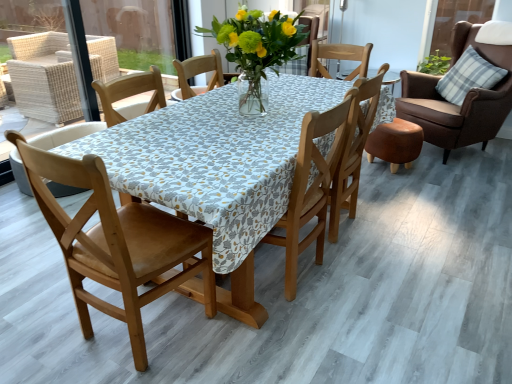
Find the location of a particular element. wooden chair at center, the 1th chair when ordered from left to right is located at coordinates (116, 242).

Describe the element at coordinates (353, 148) in the screenshot. The image size is (512, 384). I see `wooden chair at center, marked as the fourth chair in a left-to-right arrangement` at that location.

What do you see at coordinates (463, 102) in the screenshot? The width and height of the screenshot is (512, 384). I see `brown leather chair at upper right, positioned as the 5th chair in left-to-right order` at bounding box center [463, 102].

Where is `wooden chair at center, acting as the 2th chair starting from the left`? This screenshot has width=512, height=384. wooden chair at center, acting as the 2th chair starting from the left is located at coordinates (130, 94).

The height and width of the screenshot is (384, 512). I want to click on wooden chair at center, the fifth chair from the right, so 116,242.

Does plaid fabric pillow at upper right turn towards wooden chair at center, arranged as the 2th chair when viewed from the right?

Yes, plaid fabric pillow at upper right is oriented towards wooden chair at center, arranged as the 2th chair when viewed from the right.

Does point (449, 95) come behind point (330, 233)?

Yes, point (449, 95) is farther from viewer.

Are plaid fabric pillow at upper right and wooden chair at center, arranged as the 2th chair when viewed from the right, far apart?

Yes, plaid fabric pillow at upper right is far from wooden chair at center, arranged as the 2th chair when viewed from the right.

Can you tell me how much plaid fabric pillow at upper right and wooden chair at center, marked as the fourth chair in a left-to-right arrangement, differ in facing direction?

There is a 63.2-degree angle between the facing directions of plaid fabric pillow at upper right and wooden chair at center, marked as the fourth chair in a left-to-right arrangement.

Which of these two, brown leather chair at upper right, marked as the 1th chair in a right-to-left arrangement, or wooden chair at center, placed as the third chair when sorted from right to left, is bigger?

brown leather chair at upper right, marked as the 1th chair in a right-to-left arrangement.

Are brown leather chair at upper right, positioned as the 5th chair in left-to-right order, and wooden chair at center, which appears as the third chair when viewed from the left, far apart?

Absolutely, brown leather chair at upper right, positioned as the 5th chair in left-to-right order, is distant from wooden chair at center, which appears as the third chair when viewed from the left.

Considering the relative positions of brown leather chair at upper right, marked as the 1th chair in a right-to-left arrangement, and wooden chair at center, placed as the third chair when sorted from right to left, in the image provided, is brown leather chair at upper right, marked as the 1th chair in a right-to-left arrangement, behind wooden chair at center, placed as the third chair when sorted from right to left,?

Yes, brown leather chair at upper right, marked as the 1th chair in a right-to-left arrangement, is behind wooden chair at center, placed as the third chair when sorted from right to left.

Is brown leather chair at upper right, marked as the 1th chair in a right-to-left arrangement, aimed at wooden chair at center, which appears as the third chair when viewed from the left?

Yes, brown leather chair at upper right, marked as the 1th chair in a right-to-left arrangement, is facing wooden chair at center, which appears as the third chair when viewed from the left.

Could you tell me if wooden chair at center, which appears as the third chair when viewed from the left, is turned towards wooden chair at center, acting as the 2th chair starting from the left?

Yes, wooden chair at center, which appears as the third chair when viewed from the left, is aimed at wooden chair at center, acting as the 2th chair starting from the left.

From a real-world perspective, is wooden chair at center, placed as the third chair when sorted from right to left, physically above wooden chair at center, acting as the 2th chair starting from the left?

No, from a real-world perspective, wooden chair at center, placed as the third chair when sorted from right to left, is not above wooden chair at center, acting as the 2th chair starting from the left.

Which of these two, wooden chair at center, which appears as the third chair when viewed from the left, or wooden chair at center, which appears as the fourth chair when viewed from the right, is bigger?

wooden chair at center, which appears as the third chair when viewed from the left.

From the image's perspective, which one is positioned higher, wooden chair at center, which appears as the fourth chair when viewed from the right, or wooden chair at center, which appears as the third chair when viewed from the left?

From the image's view, wooden chair at center, which appears as the fourth chair when viewed from the right, is above.

How distant is wooden chair at center, acting as the 2th chair starting from the left, from wooden chair at center, placed as the third chair when sorted from right to left?

The distance of wooden chair at center, acting as the 2th chair starting from the left, from wooden chair at center, placed as the third chair when sorted from right to left, is 3.45 feet.

Can you confirm if wooden chair at center, which appears as the fourth chair when viewed from the right, is smaller than wooden chair at center, placed as the third chair when sorted from right to left?

Correct, wooden chair at center, which appears as the fourth chair when viewed from the right, occupies less space than wooden chair at center, placed as the third chair when sorted from right to left.

Considering the relative positions of wooden chair at center, acting as the 2th chair starting from the left, and wooden chair at center, placed as the third chair when sorted from right to left, in the image provided, is wooden chair at center, acting as the 2th chair starting from the left, behind wooden chair at center, placed as the third chair when sorted from right to left,?

Yes, the depth of wooden chair at center, acting as the 2th chair starting from the left, is greater than that of wooden chair at center, placed as the third chair when sorted from right to left.

Is point (475, 124) closer to viewer compared to point (101, 247)?

No.

Is brown leather chair at upper right, marked as the 1th chair in a right-to-left arrangement, not close to wooden chair at center, the fifth chair from the right?

Yes, brown leather chair at upper right, marked as the 1th chair in a right-to-left arrangement, is far from wooden chair at center, the fifth chair from the right.

What's the angular difference between brown leather chair at upper right, positioned as the 5th chair in left-to-right order, and wooden chair at center, the fifth chair from the right,'s facing directions?

There is a 148-degree angle between the facing directions of brown leather chair at upper right, positioned as the 5th chair in left-to-right order, and wooden chair at center, the fifth chair from the right.

Is brown leather chair at upper right, marked as the 1th chair in a right-to-left arrangement, taller than wooden chair at center, the fifth chair from the right?

Indeed, brown leather chair at upper right, marked as the 1th chair in a right-to-left arrangement, has a greater height compared to wooden chair at center, the fifth chair from the right.

Considering the sizes of brown leather chair at upper right, marked as the 1th chair in a right-to-left arrangement, and wooden chair at center, marked as the fourth chair in a left-to-right arrangement, in the image, is brown leather chair at upper right, marked as the 1th chair in a right-to-left arrangement, wider or thinner than wooden chair at center, marked as the fourth chair in a left-to-right arrangement,?

Clearly, brown leather chair at upper right, marked as the 1th chair in a right-to-left arrangement, has more width compared to wooden chair at center, marked as the fourth chair in a left-to-right arrangement.

Considering the sizes of brown leather chair at upper right, marked as the 1th chair in a right-to-left arrangement, and wooden chair at center, arranged as the 2th chair when viewed from the right, in the image, is brown leather chair at upper right, marked as the 1th chair in a right-to-left arrangement, bigger or smaller than wooden chair at center, arranged as the 2th chair when viewed from the right,?

In the image, brown leather chair at upper right, marked as the 1th chair in a right-to-left arrangement, appears to be larger than wooden chair at center, arranged as the 2th chair when viewed from the right.

Consider the image. Are brown leather chair at upper right, positioned as the 5th chair in left-to-right order, and wooden chair at center, arranged as the 2th chair when viewed from the right, making contact?

No.

There is a wooden chair at center, marked as the fourth chair in a left-to-right arrangement. At what (x,y) coordinates should I click in order to perform the action: click on the 2nd chair above it (from the image's perspective). Please return your answer as a coordinate pair (x, y). Looking at the image, I should click on (463, 102).

This screenshot has height=384, width=512. Identify the location of chair that is the 2nd object located below the translucent glass vase at center (from the image's perspective). (353, 148).

Can you see wooden chair at center, arranged as the 2th chair when viewed from the right, touching translucent glass vase at center?

wooden chair at center, arranged as the 2th chair when viewed from the right, and translucent glass vase at center are clearly separated.

Is wooden chair at center, arranged as the 2th chair when viewed from the right, turned away from translucent glass vase at center?

That's not correct — wooden chair at center, arranged as the 2th chair when viewed from the right, is not looking away from translucent glass vase at center.

From the image's perspective, would you say wooden chair at center, marked as the fourth chair in a left-to-right arrangement, is shown under translucent glass vase at center?

Indeed, from the image's perspective, wooden chair at center, marked as the fourth chair in a left-to-right arrangement, is shown beneath translucent glass vase at center.

At what (x,y) coordinates should I click in order to perform the action: click on chair that is the 2nd object located in front of the plaid fabric pillow at upper right. Please return your answer as a coordinate pair (x, y). Image resolution: width=512 pixels, height=384 pixels. Looking at the image, I should click on (353, 148).

This screenshot has height=384, width=512. Find the location of `the 2nd chair counting from the left of the brown leather chair at upper right, marked as the 1th chair in a right-to-left arrangement`. the 2nd chair counting from the left of the brown leather chair at upper right, marked as the 1th chair in a right-to-left arrangement is located at coordinates (310, 189).

When comparing their distances from wooden chair at center, the 1th chair when ordered from left to right, does translucent glass vase at center or wooden chair at center, arranged as the 2th chair when viewed from the right, seem further?

wooden chair at center, arranged as the 2th chair when viewed from the right.

From the image, which object appears to be farther from wooden chair at center, the fifth chair from the right, wooden chair at center, marked as the fourth chair in a left-to-right arrangement, or brown leather chair at upper right, positioned as the 5th chair in left-to-right order?

Among the two, brown leather chair at upper right, positioned as the 5th chair in left-to-right order, is located further to wooden chair at center, the fifth chair from the right.

Based on their spatial positions, is wooden chair at center, which appears as the third chair when viewed from the left, or translucent glass vase at center further from wooden chair at center, acting as the 2th chair starting from the left?

wooden chair at center, which appears as the third chair when viewed from the left, is positioned further to the anchor wooden chair at center, acting as the 2th chair starting from the left.

Based on their spatial positions, is wooden chair at center, arranged as the 2th chair when viewed from the right, or plaid fabric pillow at upper right closer to wooden chair at center, the 1th chair when ordered from left to right?

wooden chair at center, arranged as the 2th chair when viewed from the right.

Looking at the image, which one is located further to wooden chair at center, the 1th chair when ordered from left to right, brown leather chair at upper right, positioned as the 5th chair in left-to-right order, or wooden chair at center, marked as the fourth chair in a left-to-right arrangement?

brown leather chair at upper right, positioned as the 5th chair in left-to-right order.

Estimate the real-world distances between objects in this image. Which object is closer to plaid fabric pillow at upper right, wooden chair at center, which appears as the fourth chair when viewed from the right, or wooden chair at center, the fifth chair from the right?

wooden chair at center, which appears as the fourth chair when viewed from the right.

When comparing their distances from wooden chair at center, the 1th chair when ordered from left to right, does translucent glass vase at center or wooden chair at center, which appears as the third chair when viewed from the left, seem closer?

wooden chair at center, which appears as the third chair when viewed from the left, is closer to wooden chair at center, the 1th chair when ordered from left to right.

Based on their spatial positions, is wooden chair at center, which appears as the third chair when viewed from the left, or wooden chair at center, acting as the 2th chair starting from the left, closer to wooden chair at center, marked as the fourth chair in a left-to-right arrangement?

The object closer to wooden chair at center, marked as the fourth chair in a left-to-right arrangement, is wooden chair at center, which appears as the third chair when viewed from the left.

The image size is (512, 384). I want to click on floral arrangement located between wooden chair at center, acting as the 2th chair starting from the left, and brown leather chair at upper right, marked as the 1th chair in a right-to-left arrangement, in the left-right direction, so click(256, 50).

You are a GUI agent. You are given a task and a screenshot of the screen. Output one action in this format:
    pyautogui.click(x=<x>, y=<y>)
    Task: Click on the floral arrangement between wooden chair at center, the 1th chair when ordered from left to right, and wooden chair at center, arranged as the 2th chair when viewed from the right
    The height and width of the screenshot is (384, 512).
    Given the screenshot: What is the action you would take?
    pyautogui.click(x=256, y=50)

Locate an element on the screen. This screenshot has width=512, height=384. floral arrangement between wooden chair at center, the fifth chair from the right, and brown leather chair at upper right, marked as the 1th chair in a right-to-left arrangement, from left to right is located at coordinates (256, 50).

Identify the location of floral arrangement situated between wooden chair at center, the 1th chair when ordered from left to right, and plaid fabric pillow at upper right from left to right. The image size is (512, 384). (256, 50).